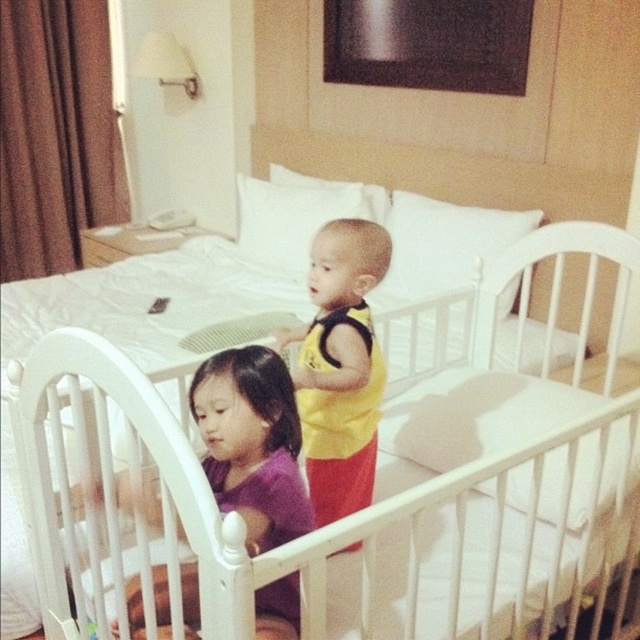
Which is in front, point (225, 502) or point (356, 461)?

Point (225, 502) is in front.

Which is behind, point (288, 401) or point (353, 484)?

Point (353, 484)

The width and height of the screenshot is (640, 640). I want to click on purple matte shirt at center, so click(x=252, y=444).